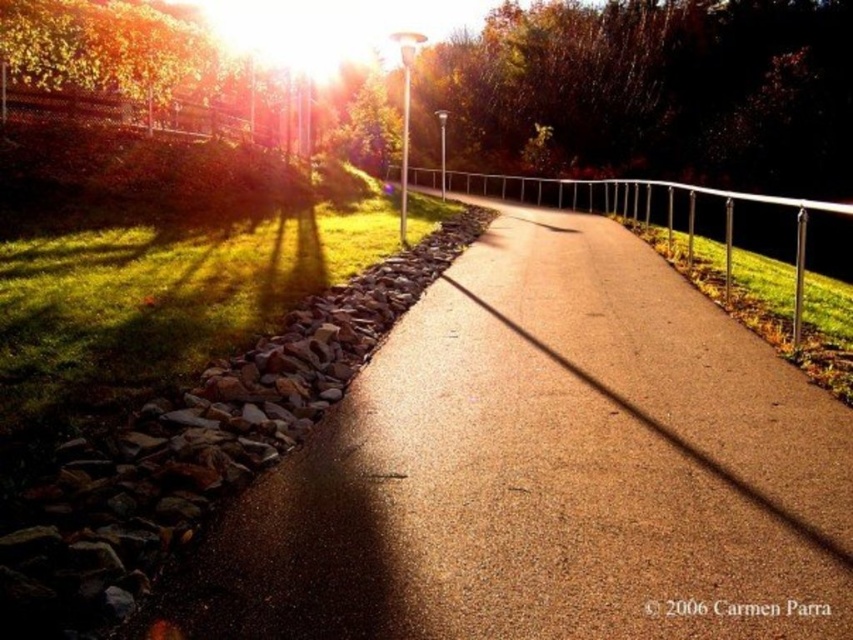
You are standing at the starting point of the path and want to walk to the end of the smooth asphalt road at center. Which direction should you head?

The smooth asphalt road at center is located at coordinates point (544, 472), so you should head towards that direction to reach the end of the smooth asphalt road at center.